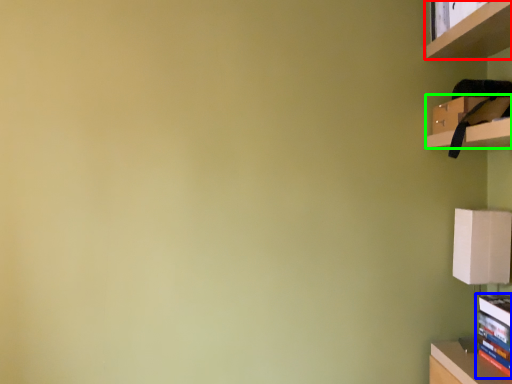
Question: Based on their relative distances, which object is farther from shelf (highlighted by a red box)? Choose from book (highlighted by a blue box) and cabinet (highlighted by a green box).

Choices:
 (A) book
 (B) cabinet

Answer: (A)